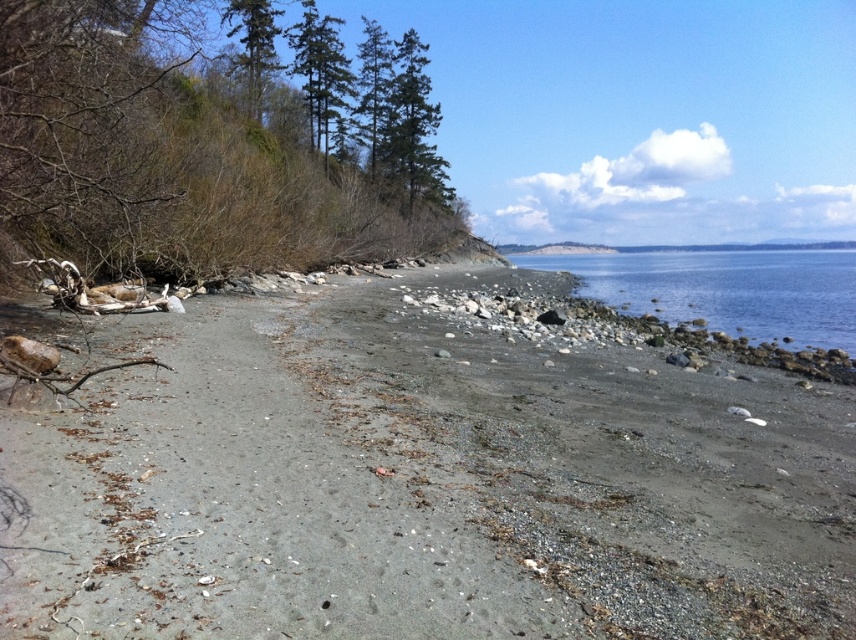
You are standing on the gray gravel beach at center and want to reach the clear blue water at center. Based on the scene description, which direction should you move to get closer to the water?

Since the gray gravel beach at center is shorter than the clear blue water at center, you should move forward towards the direction of the water to get closer.